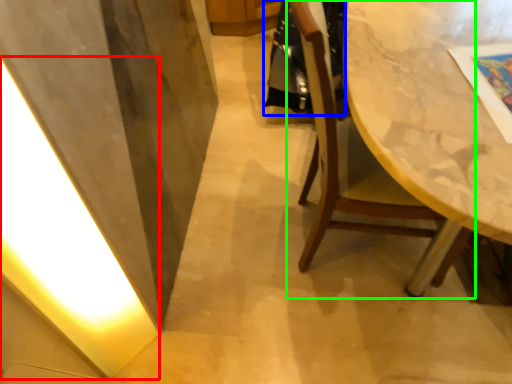
Question: Based on their relative distances, which object is farther from light (highlighted by a red box)? Choose from robe (highlighted by a blue box) and chair (highlighted by a green box).

Choices:
 (A) robe
 (B) chair

Answer: (A)